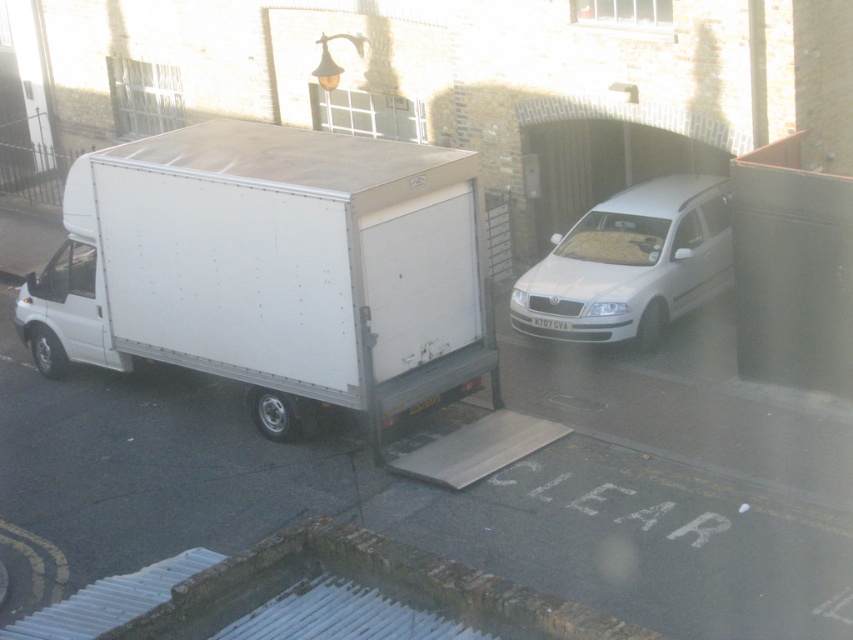
Is white matte truck at left below white matte van at center?

Correct, white matte truck at left is located below white matte van at center.

Which is in front, point (474, 177) or point (663, 221)?

Point (474, 177)

Who is more distant from viewer, (84,202) or (637,284)?

Point (637,284)

What are the coordinates of `white matte truck at left` in the screenshot? It's located at (273, 268).

Can you confirm if white matte truck at left is positioned above white plastic license plate at center?

No, white matte truck at left is not above white plastic license plate at center.

Which is in front, point (120, 209) or point (556, 321)?

Point (120, 209)

I want to click on white matte truck at left, so click(273, 268).

Is point (601, 244) positioned in front of point (532, 324)?

No.

In order to click on white matte van at center in this screenshot , I will do `click(631, 262)`.